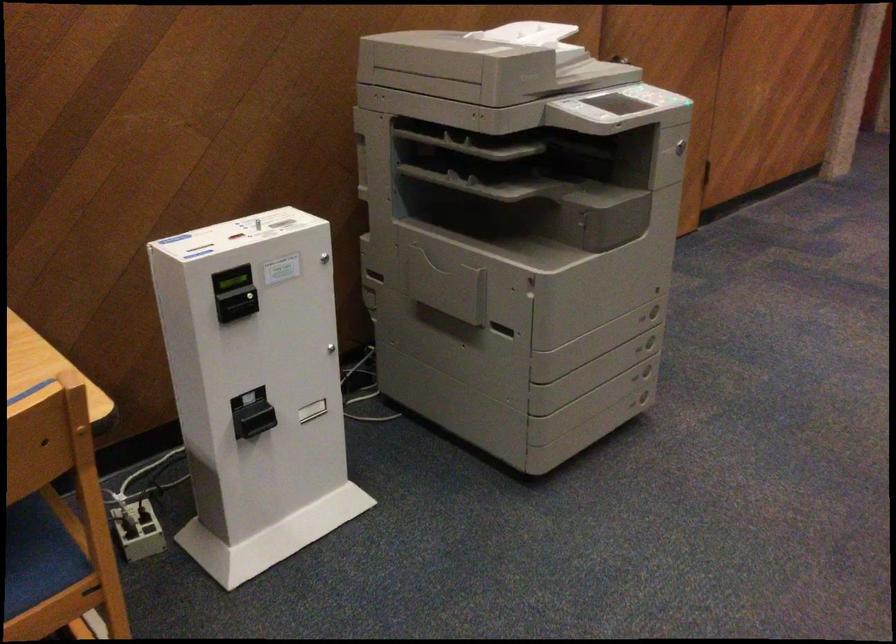
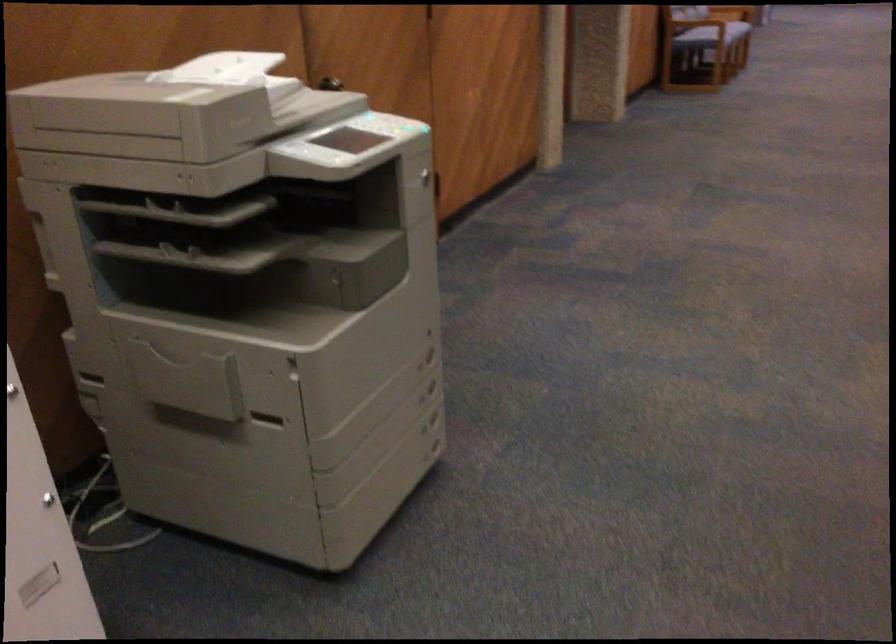
Question: Which direction would the cameraman need to move to produce the second image? Reply with the corresponding letter.

Choices:
 (A) Left
 (B) Right
 (C) Forward
 (D) Backward

Answer: (C)